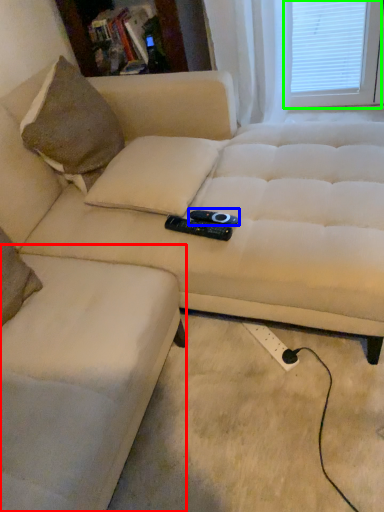
Question: Which object is positioned closest to swivel chair (highlighted by a red box)? Select from remote (highlighted by a blue box) and window screen (highlighted by a green box).

Choices:
 (A) remote
 (B) window screen

Answer: (A)